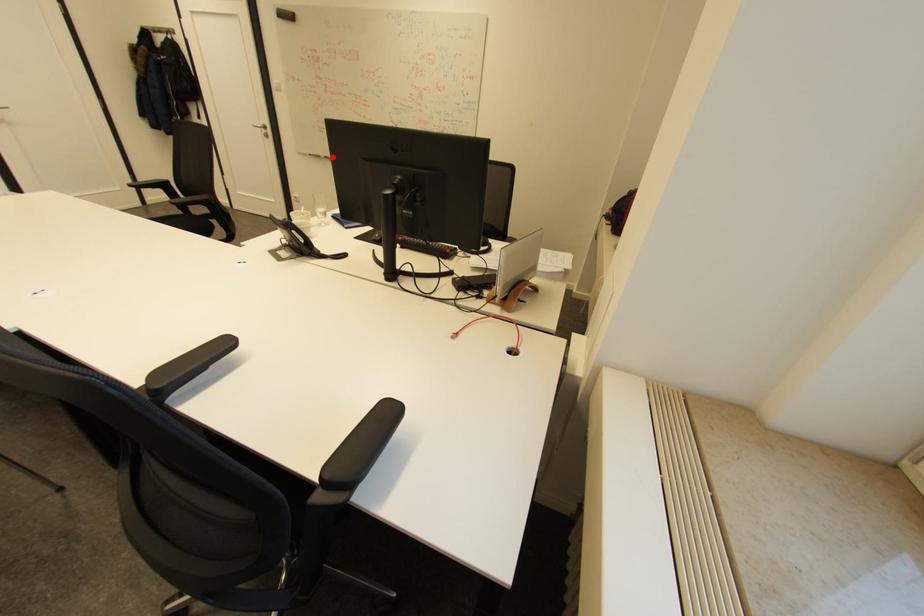
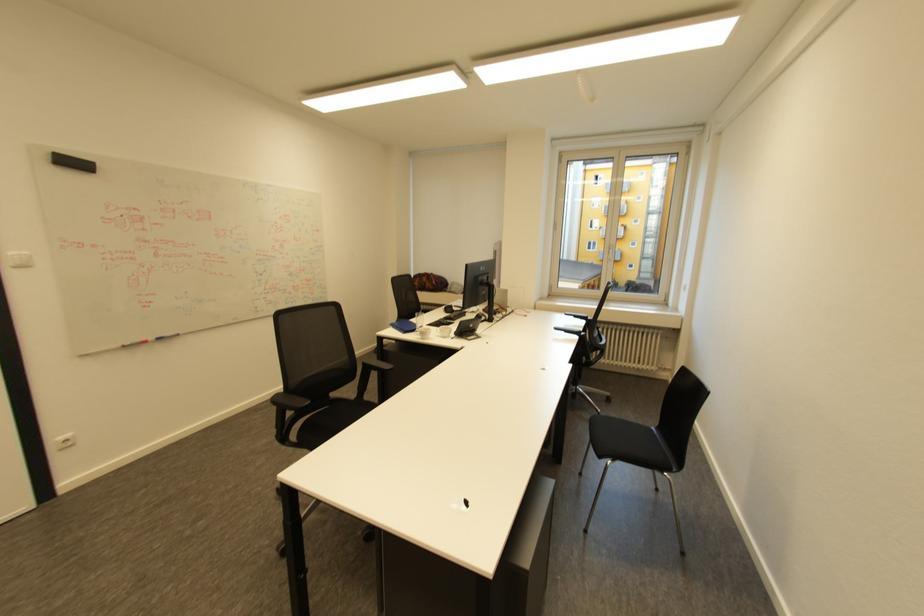
Find the pixel in the second image that matches the highlighted location in the first image.

(164, 339)